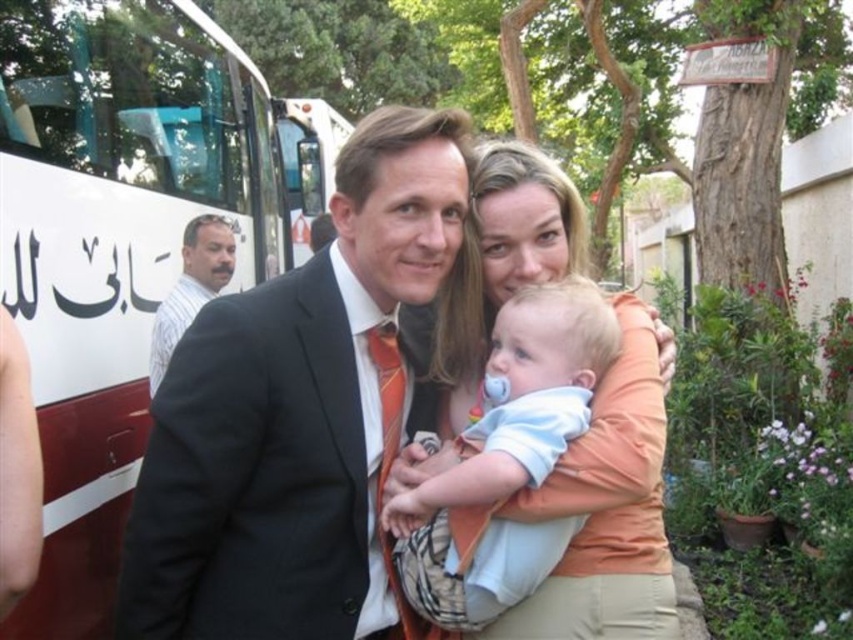
Which is more to the right, white matte bus at left or striped shirt at left?

striped shirt at left is more to the right.

Is point (84, 1) in front of point (222, 273)?

That is True.

I want to click on white matte bus at left, so click(114, 244).

Can you confirm if black suit at center is positioned to the right of light blue fabric baby at center?

Incorrect, black suit at center is not on the right side of light blue fabric baby at center.

Who is positioned more to the left, black suit at center or light blue fabric baby at center?

black suit at center is more to the left.

Is point (281, 362) positioned before point (534, 340)?

Yes, it is.

Find the location of a particular element. black suit at center is located at coordinates (297, 413).

Is black suit at center taller than white matte bus at left?

Incorrect, black suit at center's height is not larger of white matte bus at left's.

Who is higher up, black suit at center or white matte bus at left?

white matte bus at left is higher up.

Measure the distance between black suit at center and camera.

1.36 meters

You are a GUI agent. You are given a task and a screenshot of the screen. Output one action in this format:
    pyautogui.click(x=<x>, y=<y>)
    Task: Click on the black suit at center
    
    Given the screenshot: What is the action you would take?
    pyautogui.click(x=297, y=413)